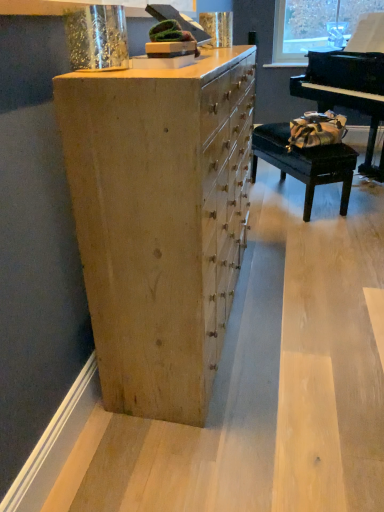
Question: Visually, is black leather table at right positioned to the left or to the right of natural wood chest of drawers at center?

Choices:
 (A) right
 (B) left

Answer: (A)

Question: Considering the positions of point [317, 160] and point [124, 178], is point [317, 160] closer or farther from the camera than point [124, 178]?

Choices:
 (A) closer
 (B) farther

Answer: (B)

Question: Based on their relative distances, which object is nearer to the black polished piano at right?

Choices:
 (A) black leather table at right
 (B) natural wood chest of drawers at center

Answer: (A)

Question: Which object is the closest to the black polished piano at right?

Choices:
 (A) black leather table at right
 (B) natural wood chest of drawers at center

Answer: (A)